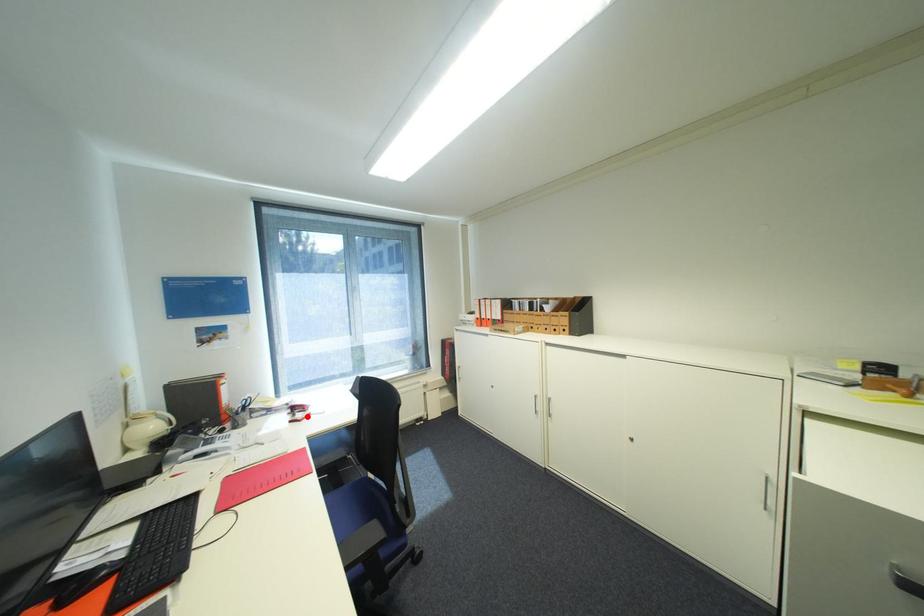
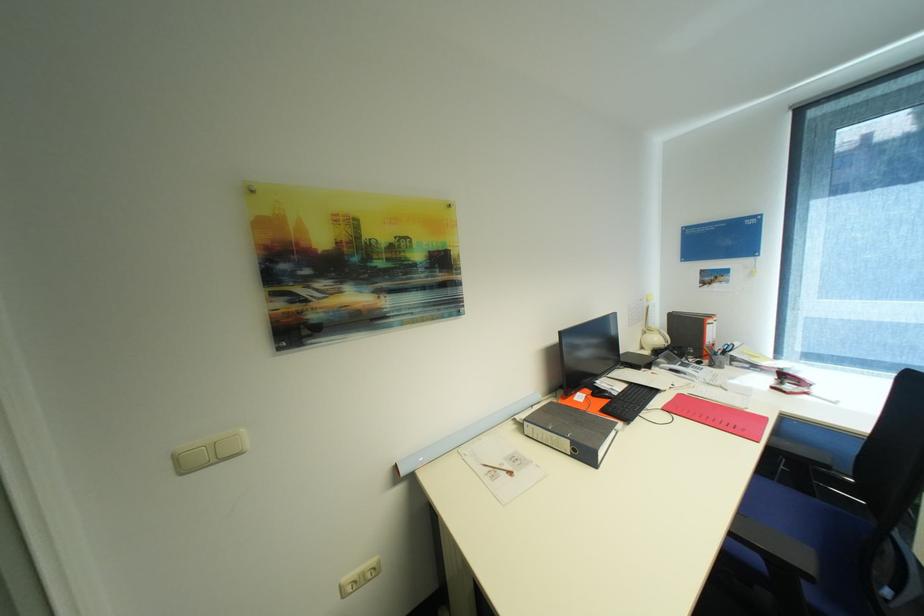
In the second image, find the point that corresponds to the highlighted location in the first image.

(796, 387)